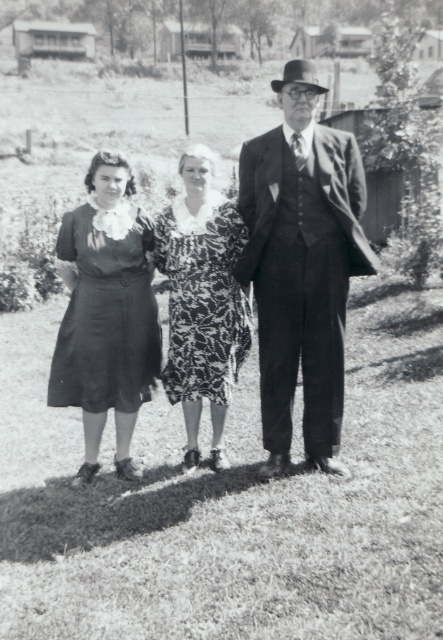
Question: Can you confirm if matte black dresses at center is wider than printed fabric dress at center?

Choices:
 (A) no
 (B) yes

Answer: (B)

Question: Is matte black dress at center further to the viewer compared to printed fabric dress at center?

Choices:
 (A) no
 (B) yes

Answer: (B)

Question: Which point appears closest to the camera in this image?

Choices:
 (A) (269, 381)
 (B) (189, 163)

Answer: (A)

Question: Which is farther from the printed fabric dress at center?

Choices:
 (A) matte black dress at center
 (B) matte black dresses at center
 (C) smooth black suit at center
 (D) matte black dress at left

Answer: (C)

Question: Is smooth black suit at center wider than matte black dresses at center?

Choices:
 (A) no
 (B) yes

Answer: (A)

Question: Estimate the real-world distances between objects in this image. Which object is closer to the smooth black suit at center?

Choices:
 (A) matte black dress at left
 (B) matte black dresses at center

Answer: (A)